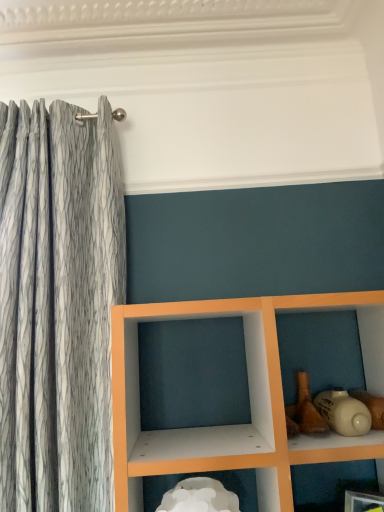
Locate an element on the screen. Image resolution: width=384 pixels, height=512 pixels. white matte cloud at lower center is located at coordinates pos(204,476).

Image resolution: width=384 pixels, height=512 pixels. What do you see at coordinates (204, 476) in the screenshot?
I see `white matte cloud at lower center` at bounding box center [204, 476].

Identify the location of white matte cloud at lower center. (204, 476).